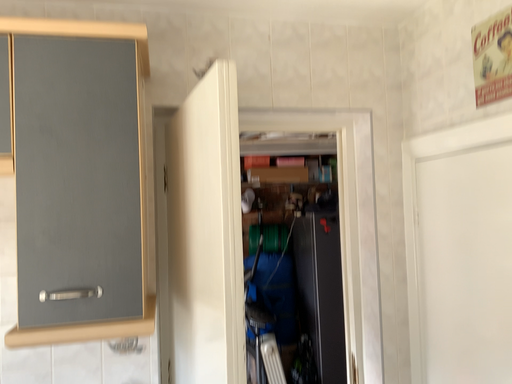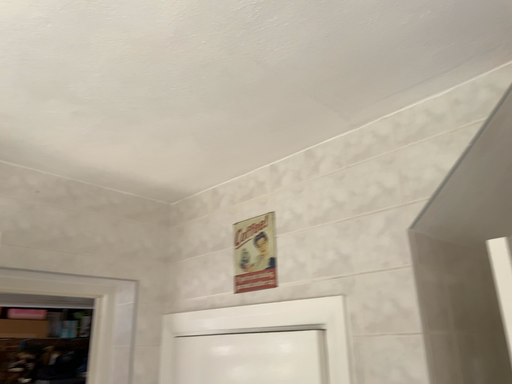
Question: How did the camera likely rotate when shooting the video?

Choices:
 (A) rotated right
 (B) rotated left

Answer: (A)